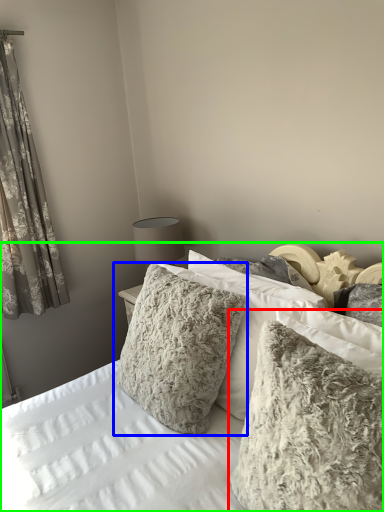
Question: Based on their relative distances, which object is farther from pillow (highlighted by a red box)? Choose from pillow (highlighted by a blue box) and bed (highlighted by a green box).

Choices:
 (A) pillow
 (B) bed

Answer: (A)